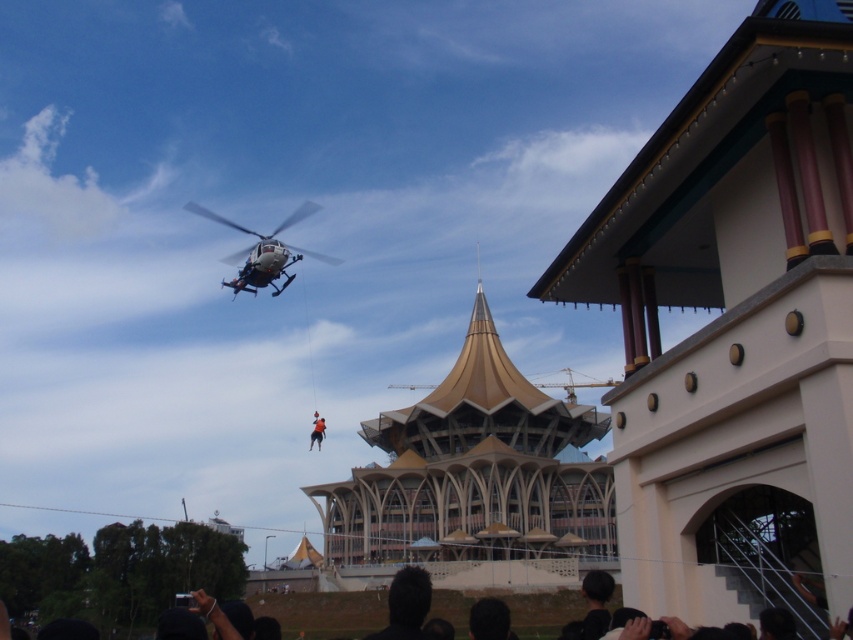
What object is located at the coordinates point (264, 252) in the image?

The point (264, 252) indicates the white matte helicopter at upper center.

You are a pilot in the white matte helicopter at upper center. You need to lower the orange fabric person at center to the ground safely. Considering their sizes, which object should you adjust the rope length for to ensure proper positioning?

The white matte helicopter at upper center is larger in size than the orange fabric person at center, so you should adjust the rope length to account for the helicopter being bigger, ensuring the person descends safely.